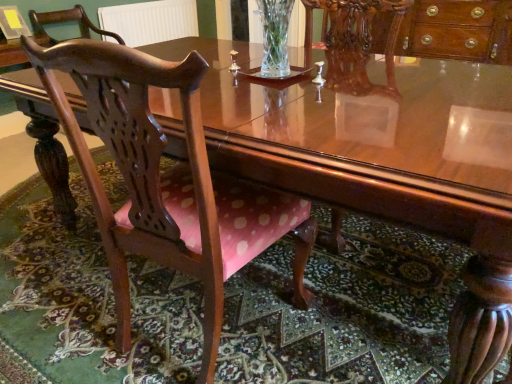
What do you see at coordinates (167, 181) in the screenshot? The image size is (512, 384). I see `polished wood chair at left, placed as the 2th chair when sorted from left to right` at bounding box center [167, 181].

I want to click on pink fabric chair at lower left, so click(344, 311).

From the image's perspective, who appears lower, polished wood chair at left, which appears as the second chair when viewed from the right, or pink fabric chair at lower left?

pink fabric chair at lower left, from the image's perspective.

Does polished wood chair at left, which appears as the second chair when viewed from the right, have a smaller size compared to pink fabric chair at lower left?

Yes, polished wood chair at left, which appears as the second chair when viewed from the right, is smaller than pink fabric chair at lower left.

Is polished wood chair at left, which is the 1th chair in back-to-front order, in contact with pink fabric chair at lower left?

polished wood chair at left, which is the 1th chair in back-to-front order, and pink fabric chair at lower left are clearly separated.

Considering the sizes of polished wood chair at left, which is the first chair in bottom-to-top order, and pink fabric chair at lower left in the image, is polished wood chair at left, which is the first chair in bottom-to-top order, bigger or smaller than pink fabric chair at lower left?

Considering their sizes, polished wood chair at left, which is the first chair in bottom-to-top order, takes up more space than pink fabric chair at lower left.

How many degrees apart are the facing directions of polished wood chair at left, the 1th chair positioned from the front, and pink fabric chair at lower left?

The facing directions of polished wood chair at left, the 1th chair positioned from the front, and pink fabric chair at lower left are 5.16 degrees apart.

Is polished wood chair at left, which ranks as the 2th chair in top-to-bottom order, surrounding pink fabric chair at lower left?

No, pink fabric chair at lower left is not a part of polished wood chair at left, which ranks as the 2th chair in top-to-bottom order.

Is polished wood chair at left, which ranks as the 2th chair in top-to-bottom order, positioned with its back to pink fabric chair at lower left?

That's not correct — polished wood chair at left, which ranks as the 2th chair in top-to-bottom order, is not looking away from pink fabric chair at lower left.

Locate an element on the screen. mat below the polished wood chair at left, the 1th chair positioned from the front (from the image's perspective) is located at coordinates (344, 311).

Considering the sizes of objects pink fabric chair at lower left and polished wood chair at left, placed as the 2th chair when sorted from left to right, in the image provided, who is wider, pink fabric chair at lower left or polished wood chair at left, placed as the 2th chair when sorted from left to right,?

With larger width is pink fabric chair at lower left.

Is pink fabric chair at lower left looking in the opposite direction of polished wood chair at left, placed as the 2th chair when sorted from left to right?

pink fabric chair at lower left does not have its back to polished wood chair at left, placed as the 2th chair when sorted from left to right.

Is there a large distance between pink fabric chair at lower left and polished wood chair at left, placed as the 2th chair when sorted from left to right?

No, pink fabric chair at lower left is in close proximity to polished wood chair at left, placed as the 2th chair when sorted from left to right.

What are the coordinates of `the 2nd chair below the white textured radiator at upper center (from the image's perspective)` in the screenshot? It's located at (167, 181).

Is white textured radiator at upper center in front of or behind polished wood chair at left, which is the first chair in bottom-to-top order, in the image?

In the image, white textured radiator at upper center appears behind polished wood chair at left, which is the first chair in bottom-to-top order.

Who is shorter, white textured radiator at upper center or polished wood chair at left, which is the first chair in bottom-to-top order?

white textured radiator at upper center.

Between white textured radiator at upper center and polished wood chair at left, placed as the 2th chair when sorted from left to right, which one has smaller size?

With smaller size is white textured radiator at upper center.

From the image's perspective, which one is positioned lower, pink fabric chair at lower left or white textured radiator at upper center?

pink fabric chair at lower left, from the image's perspective.

From the picture: Could you tell me if pink fabric chair at lower left is turned towards white textured radiator at upper center?

No, pink fabric chair at lower left is not oriented towards white textured radiator at upper center.

Does point (44, 326) appear closer or farther from the camera than point (185, 1)?

Point (44, 326) is closer to the camera than point (185, 1).

In the scene shown: Considering the sizes of objects pink fabric chair at lower left and white textured radiator at upper center in the image provided, who is wider, pink fabric chair at lower left or white textured radiator at upper center?

pink fabric chair at lower left.

Is pink fabric chair at lower left closer to camera compared to polished wood chair at left, the second chair in the front-to-back sequence?

Yes, pink fabric chair at lower left is in front of polished wood chair at left, the second chair in the front-to-back sequence.

Consider the image. Can you tell me how much pink fabric chair at lower left and polished wood chair at left, which appears as the second chair when viewed from the right, differ in facing direction?

The angle between the facing direction of pink fabric chair at lower left and the facing direction of polished wood chair at left, which appears as the second chair when viewed from the right, is 88.5 degrees.

Between pink fabric chair at lower left and polished wood chair at left, the second chair in the front-to-back sequence, which one has less height?

pink fabric chair at lower left is shorter.

Is pink fabric chair at lower left positioned beyond the bounds of polished wood chair at left, which appears as the 1th chair when viewed from the top?

Yes, pink fabric chair at lower left is located beyond the bounds of polished wood chair at left, which appears as the 1th chair when viewed from the top.

From the image's perspective, is polished wood chair at left, placed as the 2th chair when sorted from left to right, on top of white textured radiator at upper center?

Actually, polished wood chair at left, placed as the 2th chair when sorted from left to right, appears below white textured radiator at upper center in the image.

Can you see polished wood chair at left, the 1th chair positioned from the front, touching white textured radiator at upper center?

No, polished wood chair at left, the 1th chair positioned from the front, is not beside white textured radiator at upper center.

Considering the positions of objects polished wood chair at left, which ranks as the 2th chair in back-to-front order, and white textured radiator at upper center in the image provided, who is more to the left, polished wood chair at left, which ranks as the 2th chair in back-to-front order, or white textured radiator at upper center?

white textured radiator at upper center.

Would you say white textured radiator at upper center is part of polished wood chair at left, the 1th chair positioned from the front,'s contents?

Definitely not — white textured radiator at upper center is not inside polished wood chair at left, the 1th chair positioned from the front.

Where is `the 2nd chair above the pink fabric chair at lower left (from the image's perspective)`? The width and height of the screenshot is (512, 384). the 2nd chair above the pink fabric chair at lower left (from the image's perspective) is located at coordinates (66, 22).

This screenshot has height=384, width=512. Identify the location of chair in front of the pink fabric chair at lower left. (167, 181).

Which object lies nearer to the anchor point pink fabric chair at lower left, polished wood chair at left, which is the first chair in bottom-to-top order, or polished wood chair at left, positioned as the first chair in left-to-right order?

Based on the image, polished wood chair at left, which is the first chair in bottom-to-top order, appears to be nearer to pink fabric chair at lower left.

Considering their positions, is pink fabric chair at lower left positioned closer to polished wood chair at left, which ranks as the 2th chair in back-to-front order, than white textured radiator at upper center?

pink fabric chair at lower left is positioned closer to the anchor polished wood chair at left, which ranks as the 2th chair in back-to-front order.

Looking at the image, which one is located closer to polished wood chair at left, the second chair in the front-to-back sequence, pink fabric chair at lower left or white textured radiator at upper center?

Based on the image, white textured radiator at upper center appears to be nearer to polished wood chair at left, the second chair in the front-to-back sequence.

Looking at the image, which one is located closer to polished wood chair at left, which appears as the second chair when viewed from the right, white textured radiator at upper center or pink fabric chair at lower left?

Among the two, white textured radiator at upper center is located nearer to polished wood chair at left, which appears as the second chair when viewed from the right.

Considering their positions, is polished wood chair at left, positioned as the first chair in left-to-right order, positioned closer to polished wood chair at left, the 1th chair positioned from the front, than pink fabric chair at lower left?

pink fabric chair at lower left is closer to polished wood chair at left, the 1th chair positioned from the front.

Based on their spatial positions, is polished wood chair at left, which appears as the 1th chair when viewed from the top, or white textured radiator at upper center closer to polished wood chair at left, marked as the 1th chair in a right-to-left arrangement?

polished wood chair at left, which appears as the 1th chair when viewed from the top, lies closer to polished wood chair at left, marked as the 1th chair in a right-to-left arrangement, than the other object.

Estimate the real-world distances between objects in this image. Which object is closer to white textured radiator at upper center, polished wood chair at left, which appears as the second chair when viewed from the right, or pink fabric chair at lower left?

The object closer to white textured radiator at upper center is polished wood chair at left, which appears as the second chair when viewed from the right.

Based on their spatial positions, is white textured radiator at upper center or polished wood chair at left, marked as the second chair in a bottom-to-top arrangement, closer to pink fabric chair at lower left?

Based on the image, white textured radiator at upper center appears to be nearer to pink fabric chair at lower left.

Image resolution: width=512 pixels, height=384 pixels. What are the coordinates of `chair between polished wood chair at left, placed as the 2th chair when sorted from left to right, and white textured radiator at upper center from front to back` in the screenshot? It's located at (66, 22).

Where is `mat positioned between polished wood chair at left, marked as the 1th chair in a right-to-left arrangement, and white textured radiator at upper center from near to far`? mat positioned between polished wood chair at left, marked as the 1th chair in a right-to-left arrangement, and white textured radiator at upper center from near to far is located at coordinates (344, 311).

The image size is (512, 384). In order to click on chair positioned between pink fabric chair at lower left and white textured radiator at upper center from near to far in this screenshot , I will do `click(66, 22)`.

Find the location of a particular element. mat positioned between polished wood chair at left, which ranks as the 2th chair in back-to-front order, and polished wood chair at left, positioned as the first chair in left-to-right order, from near to far is located at coordinates (344, 311).